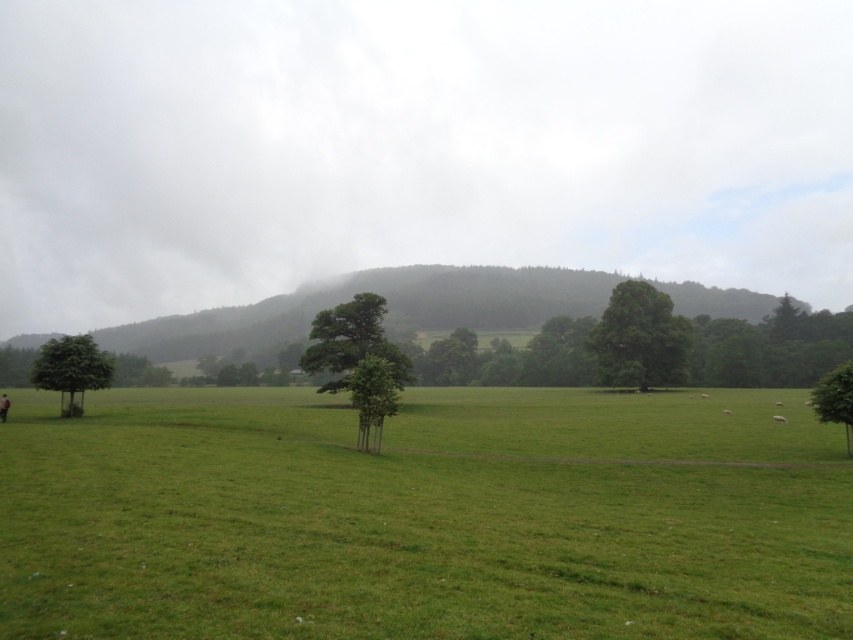
Find the location of `green leafy tree at left`. green leafy tree at left is located at coordinates (71, 369).

Describe the element at coordinates (71, 369) in the screenshot. I see `green leafy tree at left` at that location.

Locate an element on the screen. The width and height of the screenshot is (853, 640). green leafy tree at left is located at coordinates (71, 369).

Is green leafy tree at center-right wider than green leafy tree at center?

Indeed, green leafy tree at center-right has a greater width compared to green leafy tree at center.

Who is higher up, green leafy tree at center-right or green leafy tree at center?

green leafy tree at center-right is higher up.

Identify the location of green leafy tree at center-right. (x=639, y=339).

Does green leafy tree at center have a greater height compared to green leafy tree at left?

Yes.

Is point (329, 326) more distant than point (68, 372)?

Yes, point (329, 326) is farther from viewer.

The width and height of the screenshot is (853, 640). What are the coordinates of `green leafy tree at center` in the screenshot? It's located at (352, 339).